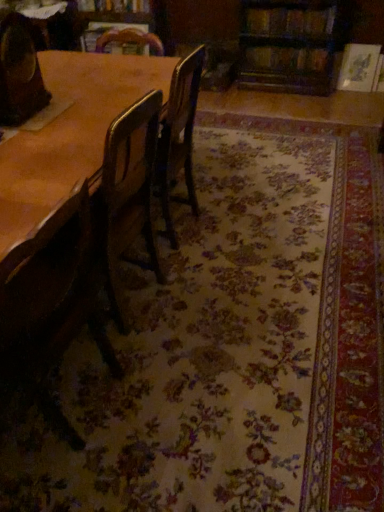
Where is `vacant space to the right of wooden chair at left, which is the first chair in top-to-bottom order`? The image size is (384, 512). vacant space to the right of wooden chair at left, which is the first chair in top-to-bottom order is located at coordinates (73, 111).